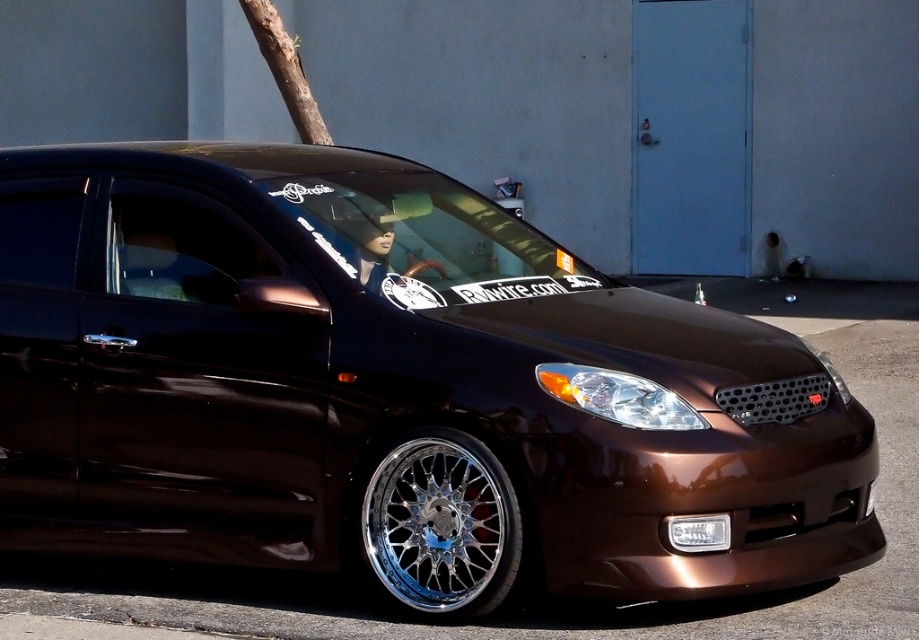
Question: Considering the real-world distances, which object is farthest from the shiny brown car at center?

Choices:
 (A) white plastic license plate at center
 (B) chrome/metallic wheel at lower center

Answer: (A)

Question: Does shiny brown car at center have a larger size compared to chrome/metallic wheel at lower center?

Choices:
 (A) no
 (B) yes

Answer: (B)

Question: Which point appears closest to the camera in this image?

Choices:
 (A) (293, 440)
 (B) (399, 609)

Answer: (B)

Question: Can you confirm if shiny brown car at center is positioned to the right of chrome/metallic wheel at lower center?

Choices:
 (A) yes
 (B) no

Answer: (B)

Question: Is chrome/metallic wheel at lower center smaller than white plastic license plate at center?

Choices:
 (A) no
 (B) yes

Answer: (A)

Question: Considering the real-world distances, which object is farthest from the shiny brown car at center?

Choices:
 (A) white plastic license plate at center
 (B) chrome/metallic wheel at lower center

Answer: (A)